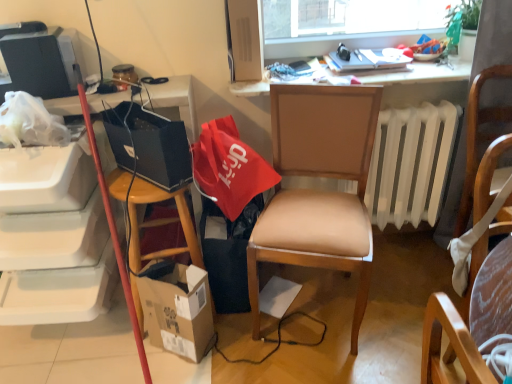
You are a GUI agent. You are given a task and a screenshot of the screen. Output one action in this format:
    pyautogui.click(x=<x>, y=<y>)
    Task: Click on the unoccupied region to the right of cardboard box at lower left
    
    Given the screenshot: What is the action you would take?
    pyautogui.click(x=246, y=349)